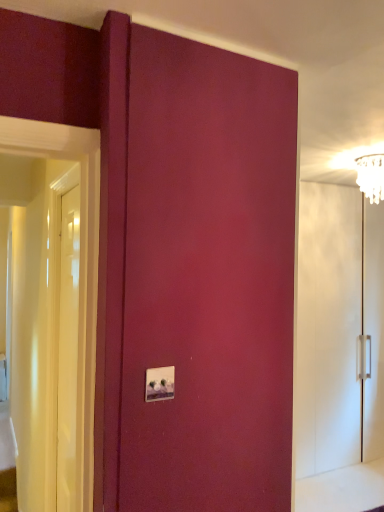
Question: Does white glossy door at left appear on the right side of white glossy cabinet at right?

Choices:
 (A) no
 (B) yes

Answer: (A)

Question: Considering the relative positions of white glossy door at left and white glossy cabinet at right in the image provided, is white glossy door at left to the left of white glossy cabinet at right from the viewer's perspective?

Choices:
 (A) yes
 (B) no

Answer: (A)

Question: Does white glossy door at left come behind white glossy cabinet at right?

Choices:
 (A) no
 (B) yes

Answer: (A)

Question: Does white glossy door at left touch white glossy cabinet at right?

Choices:
 (A) yes
 (B) no

Answer: (B)

Question: Is white glossy door at left oriented towards white glossy cabinet at right?

Choices:
 (A) yes
 (B) no

Answer: (B)

Question: Considering the positions of white glossy cabinet at right and clear glass chandelier at upper right in the image, is white glossy cabinet at right taller or shorter than clear glass chandelier at upper right?

Choices:
 (A) tall
 (B) short

Answer: (A)

Question: Is white glossy cabinet at right to the left or to the right of clear glass chandelier at upper right in the image?

Choices:
 (A) left
 (B) right

Answer: (B)

Question: From a real-world perspective, is white glossy cabinet at right positioned above or below clear glass chandelier at upper right?

Choices:
 (A) below
 (B) above

Answer: (A)

Question: From the image's perspective, is white glossy cabinet at right above or below clear glass chandelier at upper right?

Choices:
 (A) below
 (B) above

Answer: (A)

Question: In terms of height, does clear glass chandelier at upper right look taller or shorter compared to white glossy light switch at center?

Choices:
 (A) short
 (B) tall

Answer: (B)

Question: In the image, is clear glass chandelier at upper right on the left side or the right side of white glossy light switch at center?

Choices:
 (A) right
 (B) left

Answer: (A)

Question: In the image, is clear glass chandelier at upper right positioned in front of or behind white glossy light switch at center?

Choices:
 (A) front
 (B) behind

Answer: (B)

Question: Is clear glass chandelier at upper right inside the boundaries of white glossy light switch at center, or outside?

Choices:
 (A) outside
 (B) inside

Answer: (A)

Question: Is point (69, 411) closer or farther from the camera than point (357, 181)?

Choices:
 (A) farther
 (B) closer

Answer: (B)

Question: From a real-world perspective, is white glossy door at left above or below clear glass chandelier at upper right?

Choices:
 (A) below
 (B) above

Answer: (A)